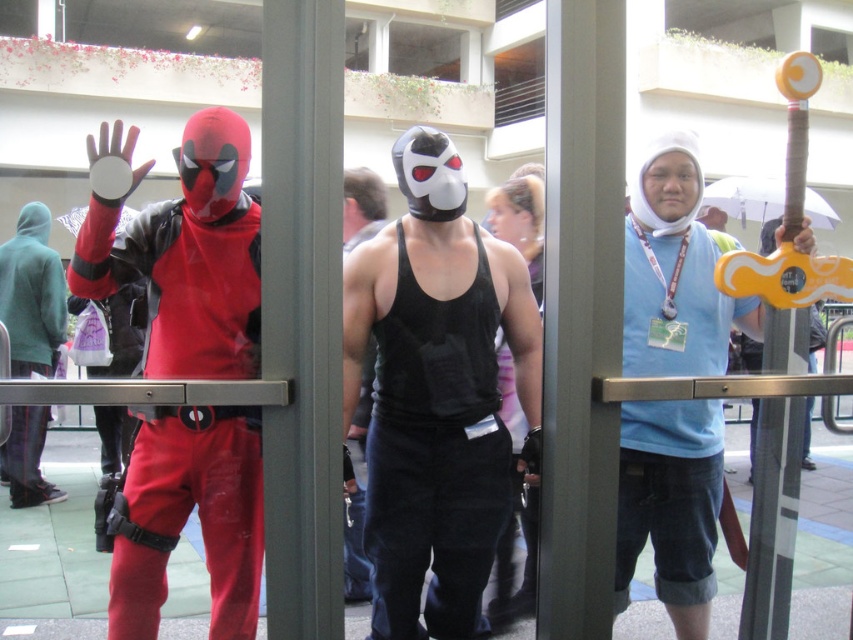
You are a photographer standing at the camera position. You want to take a closeup photo of the blue fabric shirt at center. Can you reach it without moving the camera? The camera has a 100mm lens which can focus on objects up to 1.5 meters away.

The blue fabric shirt at center is 1.98 meters from the camera, which is beyond the 1.5 meters focus range of the 100mm lens. Therefore, you cannot take a closeup photo without moving the camera closer.

You are a photographer at the event and need to capture a photo of the blue fabric shirt at center and the matte black hoodie at left. Which of the two items will appear smaller in the photo?

The blue fabric shirt at center will appear smaller in the photo because it occupies less space than the matte black hoodie at left.

You are standing at the entrance of the convention and see the blue fabric shirt at center. Can you estimate its position in terms of coordinates?

The blue fabric shirt at center is located at coordinates point (675, 272).